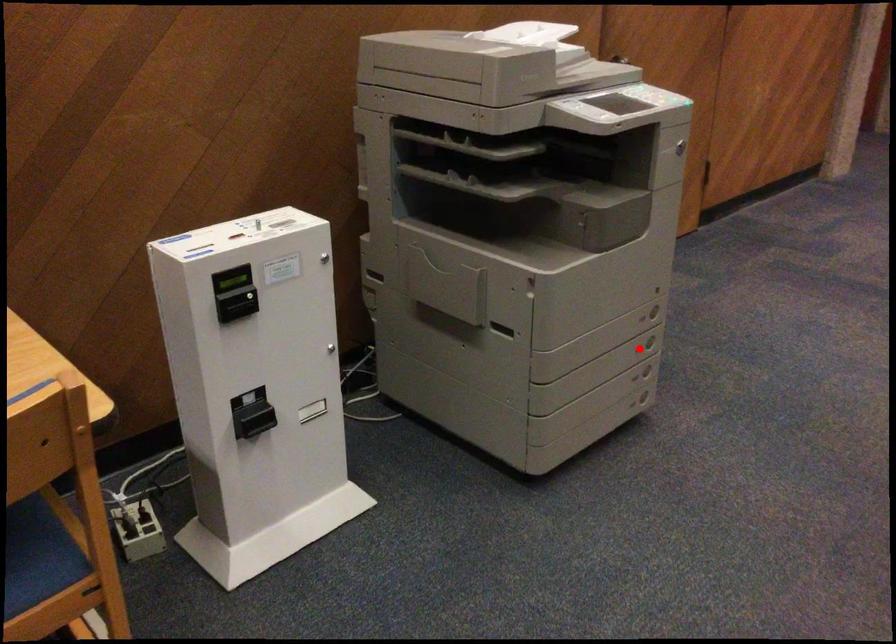
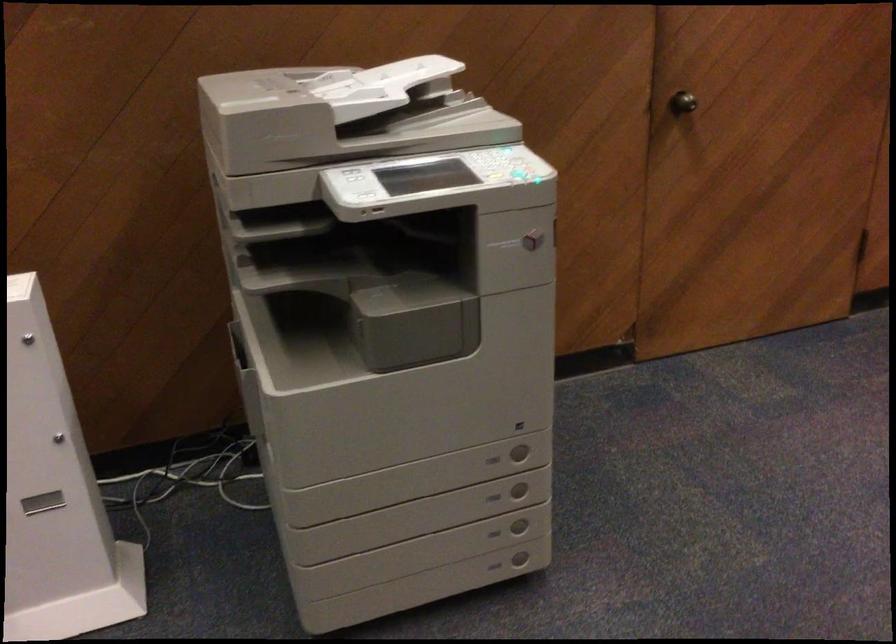
The point at the highlighted location is marked in the first image. Where is the corresponding point in the second image?

(493, 497)